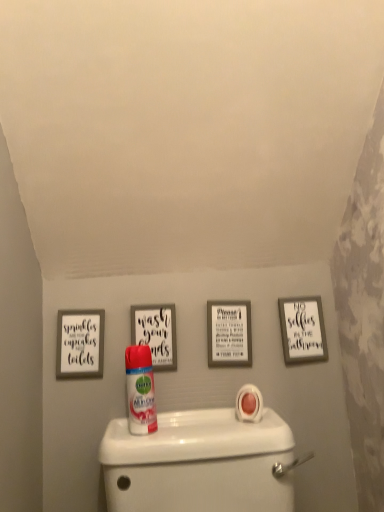
Identify the location of space that is in front of white plastic can at center. This screenshot has width=384, height=512. (148, 441).